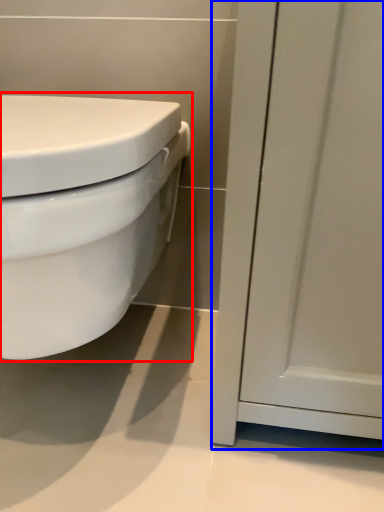
Question: Which object is further to the camera taking this photo, toilet (highlighted by a red box) or screen door (highlighted by a blue box)?

Choices:
 (A) toilet
 (B) screen door

Answer: (B)